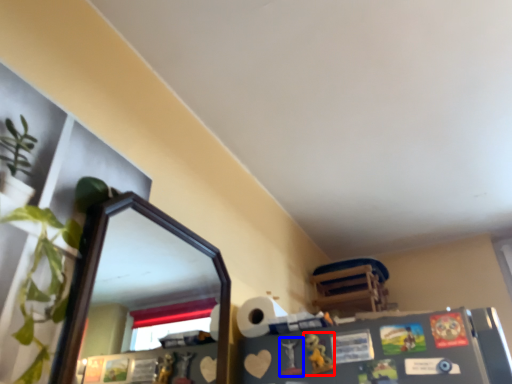
Question: Which point is further to the camera, toy (highlighted by a red box) or toy (highlighted by a blue box)?

Choices:
 (A) toy
 (B) toy

Answer: (B)